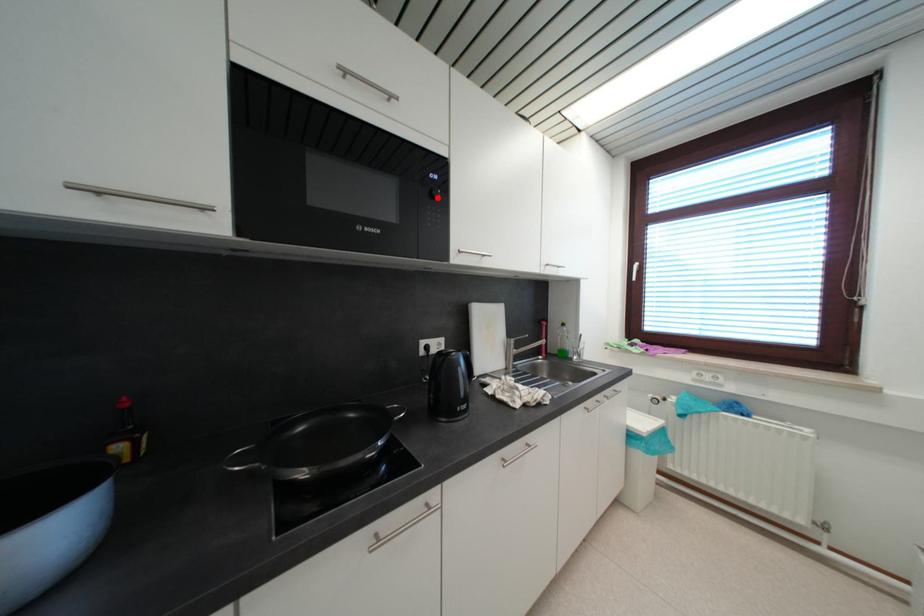
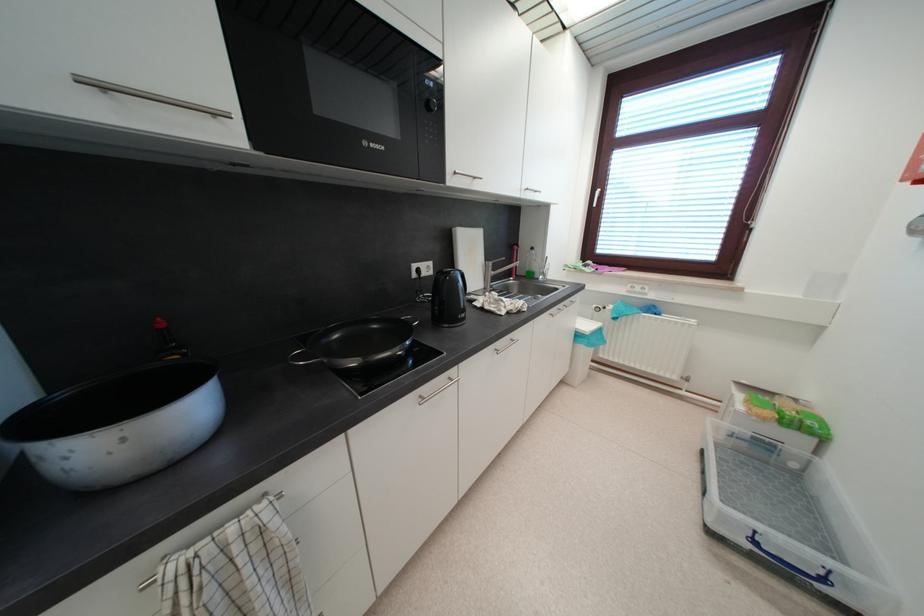
Where in the second image is the point corresponding to the highlighted location from the first image?

(433, 108)